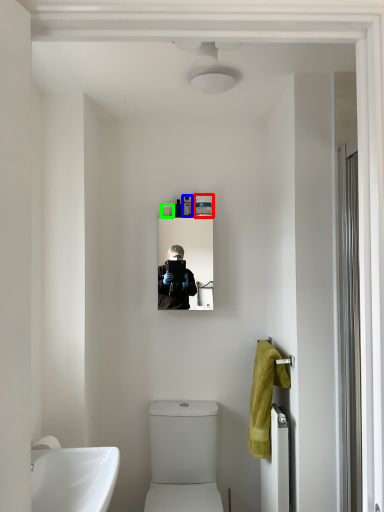
Question: Which object is positioned closest to toiletry (highlighted by a red box)? Select from toiletry (highlighted by a blue box) and toiletry (highlighted by a green box).

Choices:
 (A) toiletry
 (B) toiletry

Answer: (A)